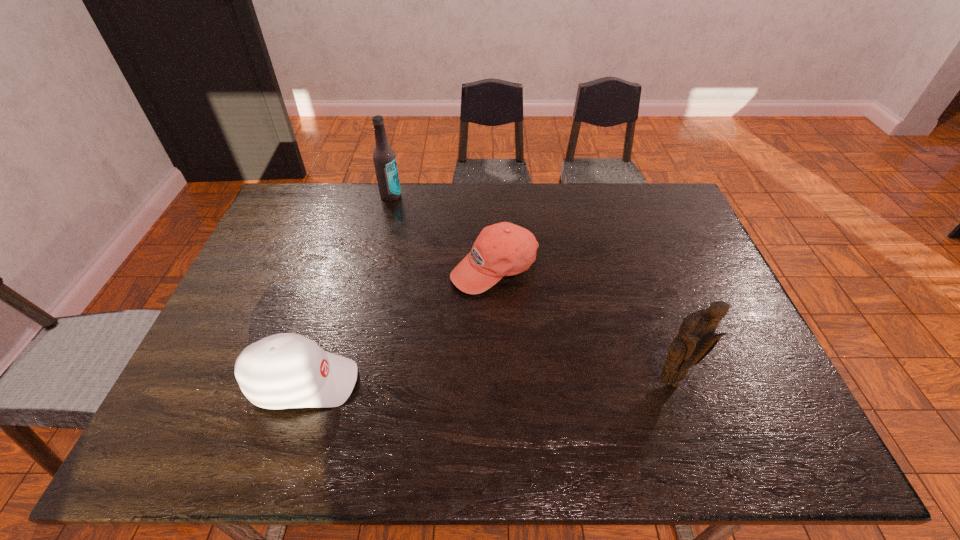
This screenshot has width=960, height=540. In order to click on vacant space at the left edge of the desktop in this screenshot , I will do `click(251, 324)`.

You are a GUI agent. You are given a task and a screenshot of the screen. Output one action in this format:
    pyautogui.click(x=<x>, y=<y>)
    Task: Click on the vacant point at the right edge
    
    Given the screenshot: What is the action you would take?
    pyautogui.click(x=708, y=266)

This screenshot has height=540, width=960. I want to click on vacant space at the far right corner of the desktop, so click(x=667, y=211).

This screenshot has width=960, height=540. Find the location of `free spot between the beer bottle and the figurine`. free spot between the beer bottle and the figurine is located at coordinates (531, 289).

In order to click on empty space that is in between the rightmost object and the nearer baseball cap in this screenshot , I will do `click(487, 382)`.

At what (x,y) coordinates should I click in order to perform the action: click on free space between the left baseball cap and the rightmost object. Please return your answer as a coordinate pair (x, y). This screenshot has width=960, height=540. Looking at the image, I should click on (487, 382).

You are a GUI agent. You are given a task and a screenshot of the screen. Output one action in this format:
    pyautogui.click(x=<x>, y=<y>)
    Task: Click on the vacant space in between the second farthest object and the figurine
    The height and width of the screenshot is (540, 960).
    Given the screenshot: What is the action you would take?
    pyautogui.click(x=582, y=325)

Identify the location of vacant area that lies between the beer bottle and the rightmost object. The image size is (960, 540). (531, 289).

Locate an element on the screen. The image size is (960, 540). blank region between the beer bottle and the nearer baseball cap is located at coordinates (347, 289).

Locate an element on the screen. The height and width of the screenshot is (540, 960). vacant space that's between the beer bottle and the left baseball cap is located at coordinates (347, 289).